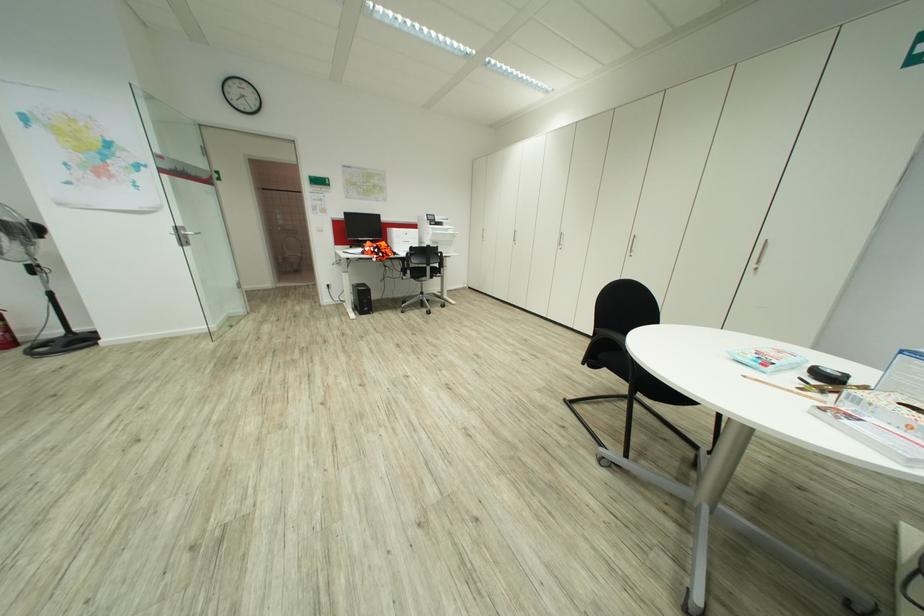
Find where to resting arm on the black chair armrest. Please return your answer as a coordinate pair (x, y).

(606, 341)